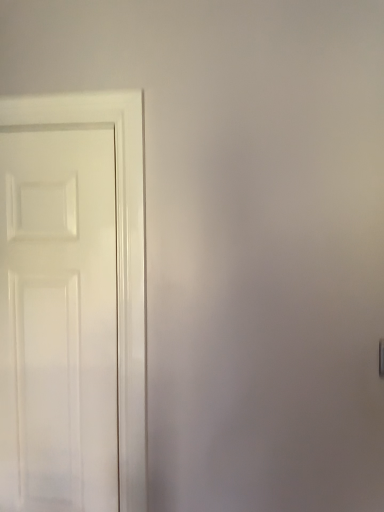
The width and height of the screenshot is (384, 512). What are the coordinates of `white glossy door at left` in the screenshot? It's located at (58, 320).

Describe the element at coordinates (58, 320) in the screenshot. I see `white glossy door at left` at that location.

At what (x,y) coordinates should I click in order to perform the action: click on white glossy door at left. Please return your answer as a coordinate pair (x, y). Looking at the image, I should click on (58, 320).